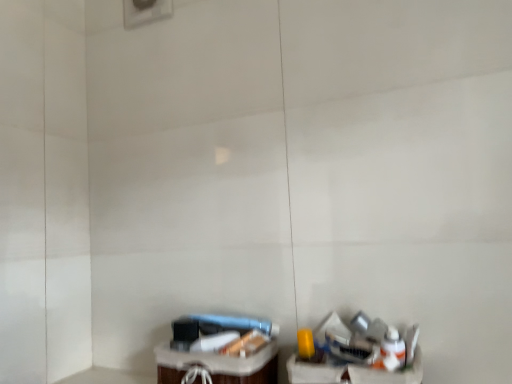
Measure the distance between point (343, 322) and camera.

Point (343, 322) is 35.39 inches from camera.

Find the location of a particular element. metallic silver trash can at lower right is located at coordinates (366, 342).

This screenshot has height=384, width=512. What do you see at coordinates (366, 342) in the screenshot?
I see `metallic silver trash can at lower right` at bounding box center [366, 342].

The width and height of the screenshot is (512, 384). Describe the element at coordinates (218, 366) in the screenshot. I see `translucent plastic basket at lower center` at that location.

Measure the distance between point (226, 375) and camera.

Point (226, 375) is 33.50 inches away from camera.

Identify the location of translucent plastic basket at lower center. (218, 366).

Find the location of a particular element. The image size is (512, 384). metallic silver trash can at lower right is located at coordinates (366, 342).

Consider the image. Between translucent plastic basket at lower center and metallic silver trash can at lower right, which one appears on the right side from the viewer's perspective?

metallic silver trash can at lower right is more to the right.

In the scene shown: Considering the positions of objects translucent plastic basket at lower center and metallic silver trash can at lower right in the image provided, who is in front, translucent plastic basket at lower center or metallic silver trash can at lower right?

metallic silver trash can at lower right is more forward.

Which point is more forward, (257,361) or (352,350)?

Positioned in front is point (352,350).

From the image's perspective, is translucent plastic basket at lower center on top of metallic silver trash can at lower right?

No.

From a real-world perspective, is translucent plastic basket at lower center positioned over metallic silver trash can at lower right based on gravity?

No, from a real-world perspective, translucent plastic basket at lower center is not above metallic silver trash can at lower right.

Which of these two, translucent plastic basket at lower center or metallic silver trash can at lower right, is wider?

translucent plastic basket at lower center is wider.

Between translucent plastic basket at lower center and metallic silver trash can at lower right, which one has more height?

metallic silver trash can at lower right is taller.

Is translucent plastic basket at lower center bigger or smaller than metallic silver trash can at lower right?

In the image, translucent plastic basket at lower center appears to be larger than metallic silver trash can at lower right.

Would you say translucent plastic basket at lower center contains metallic silver trash can at lower right?

Actually, metallic silver trash can at lower right is outside translucent plastic basket at lower center.

Is there a large distance between translucent plastic basket at lower center and metallic silver trash can at lower right?

No, translucent plastic basket at lower center is not far away from metallic silver trash can at lower right.

Is translucent plastic basket at lower center positioned with its back to metallic silver trash can at lower right?

That's not correct — translucent plastic basket at lower center is not looking away from metallic silver trash can at lower right.

The image size is (512, 384). Find the location of `furniture below the metallic silver trash can at lower right (from a real-world perspective)`. furniture below the metallic silver trash can at lower right (from a real-world perspective) is located at coordinates (218, 366).

Considering the relative positions of metallic silver trash can at lower right and translucent plastic basket at lower center in the image provided, is metallic silver trash can at lower right to the left or to the right of translucent plastic basket at lower center?

Based on their positions, metallic silver trash can at lower right is located to the right of translucent plastic basket at lower center.

Which object is more forward, metallic silver trash can at lower right or translucent plastic basket at lower center?

Positioned in front is metallic silver trash can at lower right.

Considering the positions of point (386, 351) and point (166, 343), is point (386, 351) closer or farther from the camera than point (166, 343)?

Point (386, 351) is positioned closer to the camera compared to point (166, 343).

From the image's perspective, does metallic silver trash can at lower right appear higher than translucent plastic basket at lower center?

Yes, from the image's perspective, metallic silver trash can at lower right is on top of translucent plastic basket at lower center.

From a real-world perspective, which object stands above the other?

metallic silver trash can at lower right is physically above.

Does metallic silver trash can at lower right have a lesser width compared to translucent plastic basket at lower center?

Correct, the width of metallic silver trash can at lower right is less than that of translucent plastic basket at lower center.

From their relative heights in the image, would you say metallic silver trash can at lower right is taller or shorter than translucent plastic basket at lower center?

Clearly, metallic silver trash can at lower right is taller compared to translucent plastic basket at lower center.

Who is smaller, metallic silver trash can at lower right or translucent plastic basket at lower center?

Smaller between the two is metallic silver trash can at lower right.

Is translucent plastic basket at lower center completely or partially inside metallic silver trash can at lower right?

No, translucent plastic basket at lower center is not inside metallic silver trash can at lower right.

Are metallic silver trash can at lower right and translucent plastic basket at lower center far apart?

No.

Does metallic silver trash can at lower right turn towards translucent plastic basket at lower center?

No.

Find the location of a particular element. The height and width of the screenshot is (384, 512). garbage in front of the translucent plastic basket at lower center is located at coordinates (366, 342).

Where is `garbage that is above the translucent plastic basket at lower center (from a real-world perspective)`? The height and width of the screenshot is (384, 512). garbage that is above the translucent plastic basket at lower center (from a real-world perspective) is located at coordinates (366, 342).

I want to click on garbage to the right of translucent plastic basket at lower center, so click(366, 342).